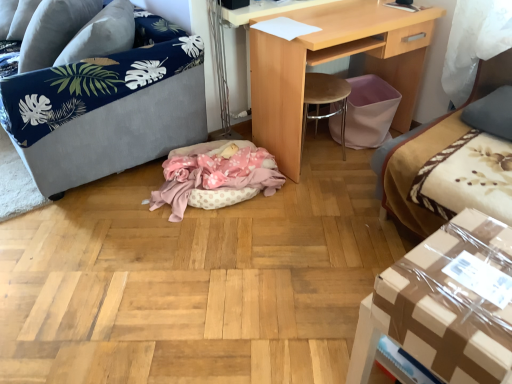
Locate an element on the screen. Image resolution: width=512 pixels, height=384 pixels. blank space to the left of pink polka dot fabric cat bed at center is located at coordinates (98, 208).